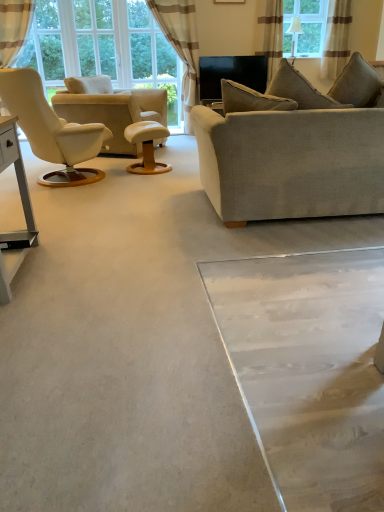
Question: Is clear glass window at upper center in front of or behind textured beige pillow at upper right in the image?

Choices:
 (A) front
 (B) behind

Answer: (B)

Question: Looking at the image, does clear glass window at upper center seem bigger or smaller compared to textured beige pillow at upper right?

Choices:
 (A) big
 (B) small

Answer: (B)

Question: Estimate the real-world distances between objects in this image. Which object is farther from the light gray fabric couch at center?

Choices:
 (A) white wood table at left
 (B) textured beige pillow at upper right
 (C) beige striped curtain at upper center, which appears as the first curtain when viewed from the left
 (D) beige leather chair at left
 (E) brown striped curtain at upper right, the second curtain viewed from the right

Answer: (E)

Question: Which of these objects is positioned closest to the textured beige pillow at upper right?

Choices:
 (A) wooden round table at center
 (B) clear glass window at upper center
 (C) beige leather chair at left
 (D) beige striped curtain at upper center, placed as the third curtain when sorted from right to left
 (E) white wood table at left

Answer: (A)